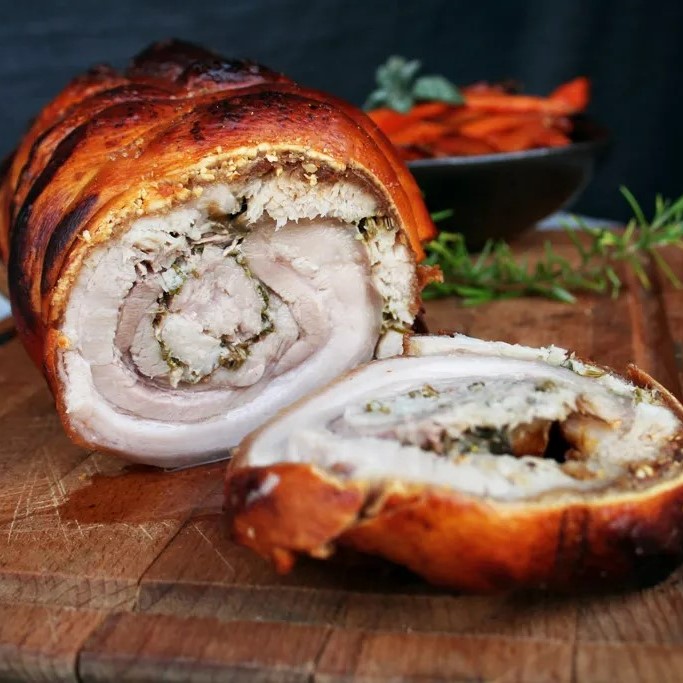
What are the coordinates of `lines in cutting board` in the screenshot? It's located at (163, 548), (328, 630), (576, 617), (70, 469).